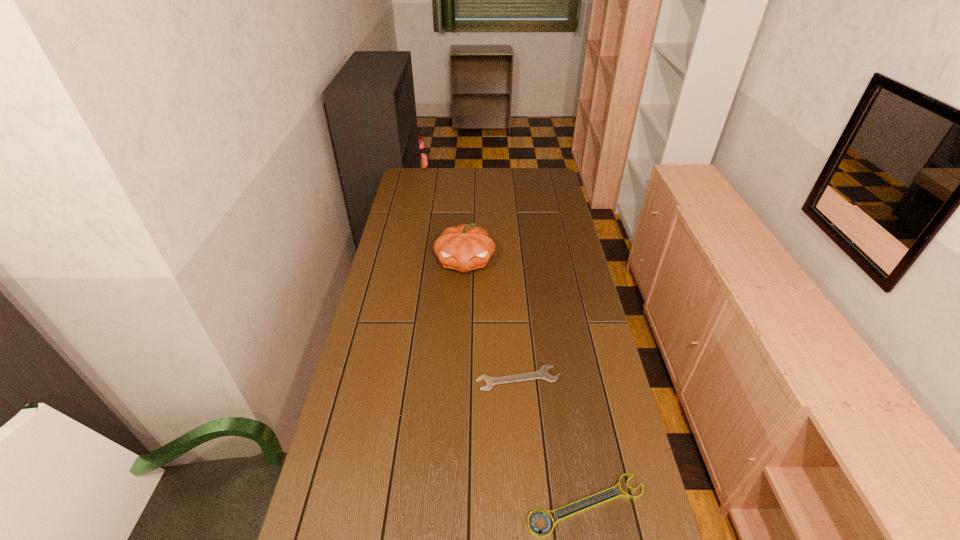
I want to click on empty space between the nearest object and the pumpkin, so click(x=526, y=383).

Locate an element on the screen. The image size is (960, 540). empty location between the leftmost object and the second nearest object is located at coordinates (470, 275).

Locate an element on the screen. The height and width of the screenshot is (540, 960). free space between the nearest object and the farthest object is located at coordinates (505, 339).

Identify the location of free space between the second farthest object and the second nearest object. The image size is (960, 540). (492, 320).

Find the location of a particular element. free area in between the nearer wrench and the pumpkin is located at coordinates (526, 383).

The image size is (960, 540). Identify the location of the closest object to the second farthest object. (543, 373).

Find the location of a particular element. Image resolution: width=960 pixels, height=540 pixels. object that is the second nearest to the root beer is located at coordinates (543, 373).

Locate an element on the screen. The width and height of the screenshot is (960, 540). blank area in the image that satisfies the following two spatial constraints: 1. on the front side of the second nearest object; 2. on the right side of the leftmost object is located at coordinates (382, 379).

The image size is (960, 540). In order to click on vacant area that satisfies the following two spatial constraints: 1. on the front side of the root beer; 2. on the left side of the nearest object in this screenshot , I will do `click(356, 505)`.

Identify the location of vacant space that satisfies the following two spatial constraints: 1. on the front face of the pumpkin; 2. on the right side of the nearest object. (455, 505).